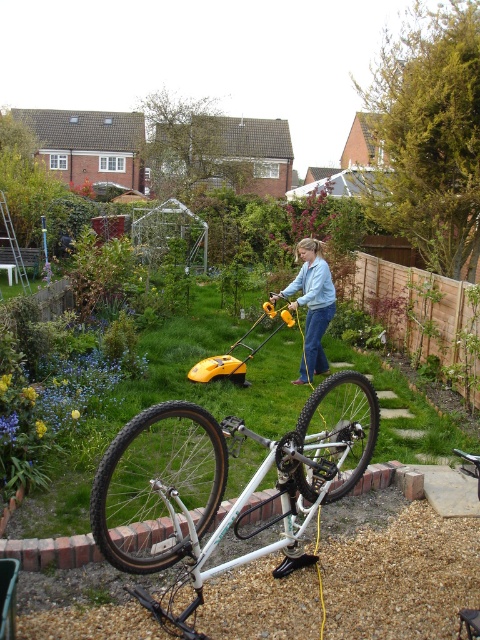
Does white metallic bicycle at center appear over white matte mountain bike at center?

Actually, white metallic bicycle at center is below white matte mountain bike at center.

Measure the distance between point (251, 554) and camera.

Point (251, 554) and camera are 3.14 meters apart.

You are a GUI agent. You are given a task and a screenshot of the screen. Output one action in this format:
    pyautogui.click(x=<x>, y=<y>)
    Task: Click on the white metallic bicycle at center
    This screenshot has width=480, height=640.
    Given the screenshot: What is the action you would take?
    pyautogui.click(x=224, y=480)

Who is more forward, (163, 390) or (300, 284)?

Point (163, 390) is more forward.

You are a GUI agent. You are given a task and a screenshot of the screen. Output one action in this format:
    pyautogui.click(x=<x>, y=<y>)
    Task: Click on the green grass at center
    
    Given the screenshot: What is the action you would take?
    pyautogui.click(x=165, y=400)

Find the location of `green grass at center`. green grass at center is located at coordinates (165, 400).

Which is below, white metallic bicycle at center or black rubber tire at lower left?

black rubber tire at lower left is lower down.

Measure the distance from white metallic bicycle at center to black rubber tire at lower left.

6.59 inches

The image size is (480, 640). What do you see at coordinates (224, 480) in the screenshot?
I see `white metallic bicycle at center` at bounding box center [224, 480].

Find the location of a particular element. white metallic bicycle at center is located at coordinates (224, 480).